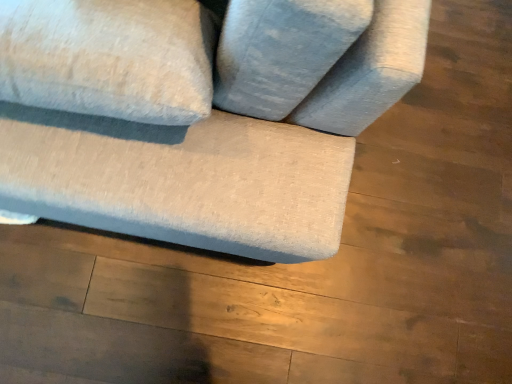
In order to click on vacant space to the right of textured fabric couch at lower right in this screenshot , I will do `click(402, 220)`.